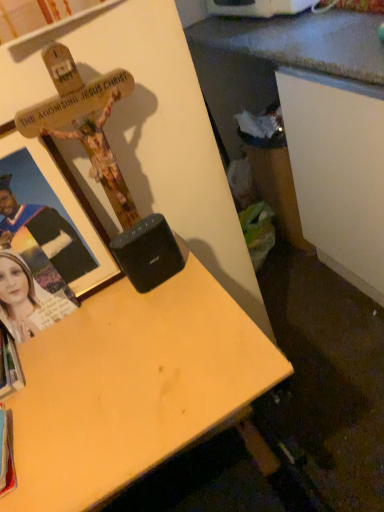
Question: Is black plastic speaker at center further to the viewer compared to matte black photo frame at left?

Choices:
 (A) yes
 (B) no

Answer: (A)

Question: Is black plastic speaker at center at the right side of matte black photo frame at left?

Choices:
 (A) no
 (B) yes

Answer: (B)

Question: Can you confirm if black plastic speaker at center is wider than matte black photo frame at left?

Choices:
 (A) yes
 (B) no

Answer: (A)

Question: Can you confirm if black plastic speaker at center is bigger than matte black photo frame at left?

Choices:
 (A) no
 (B) yes

Answer: (A)

Question: Is black plastic speaker at center thinner than matte black photo frame at left?

Choices:
 (A) yes
 (B) no

Answer: (B)

Question: In terms of width, does wooden cross at upper left look wider or thinner when compared to light wood desk at center?

Choices:
 (A) wide
 (B) thin

Answer: (B)

Question: From a real-world perspective, relative to light wood desk at center, is wooden cross at upper left vertically above or below?

Choices:
 (A) below
 (B) above

Answer: (B)

Question: Considering the positions of point (104, 260) and point (107, 395), is point (104, 260) closer or farther from the camera than point (107, 395)?

Choices:
 (A) closer
 (B) farther

Answer: (B)

Question: From the image's perspective, is wooden cross at upper left above or below light wood desk at center?

Choices:
 (A) below
 (B) above

Answer: (B)

Question: Considering the positions of black plastic speaker at center and matte black photo frame at left in the image, is black plastic speaker at center wider or thinner than matte black photo frame at left?

Choices:
 (A) thin
 (B) wide

Answer: (B)

Question: Is black plastic speaker at center inside the boundaries of matte black photo frame at left, or outside?

Choices:
 (A) outside
 (B) inside

Answer: (A)

Question: From their relative heights in the image, would you say black plastic speaker at center is taller or shorter than matte black photo frame at left?

Choices:
 (A) tall
 (B) short

Answer: (B)

Question: In terms of size, does black plastic speaker at center appear bigger or smaller than matte black photo frame at left?

Choices:
 (A) big
 (B) small

Answer: (B)

Question: In the image, is white paper book at lower left positioned in front of or behind light wood desk at center?

Choices:
 (A) front
 (B) behind

Answer: (B)

Question: In terms of size, does white paper book at lower left appear bigger or smaller than light wood desk at center?

Choices:
 (A) small
 (B) big

Answer: (A)